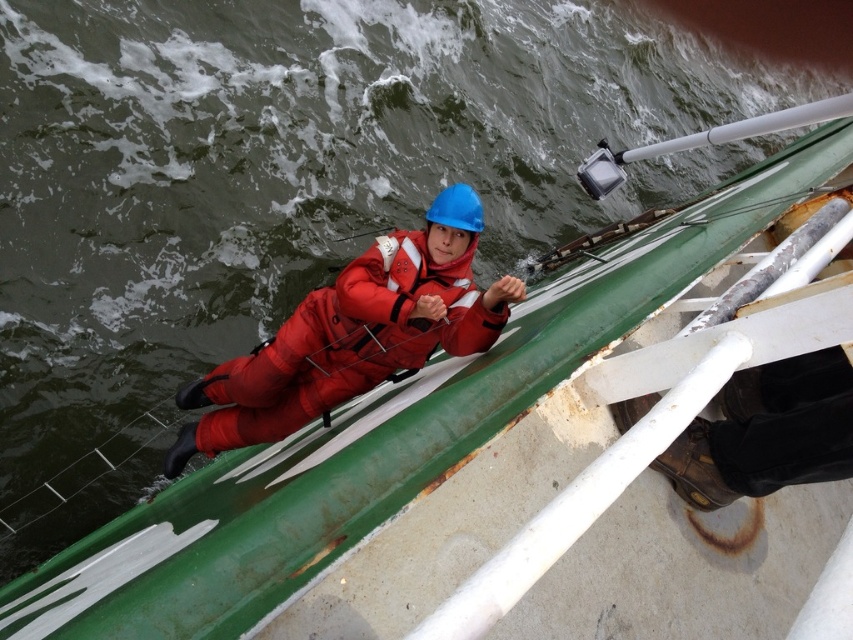
Question: Which of the following is the farthest from the observer?

Choices:
 (A) red matte suit at center
 (B) red matte life jacket at center

Answer: (B)

Question: Does red matte suit at center have a lesser width compared to red matte life jacket at center?

Choices:
 (A) no
 (B) yes

Answer: (A)

Question: Does red matte suit at center appear over red matte life jacket at center?

Choices:
 (A) yes
 (B) no

Answer: (B)

Question: Which of the following is the closest to the observer?

Choices:
 (A) (473, 285)
 (B) (438, 317)

Answer: (B)

Question: Can you confirm if red matte suit at center is thinner than red matte life jacket at center?

Choices:
 (A) yes
 (B) no

Answer: (B)